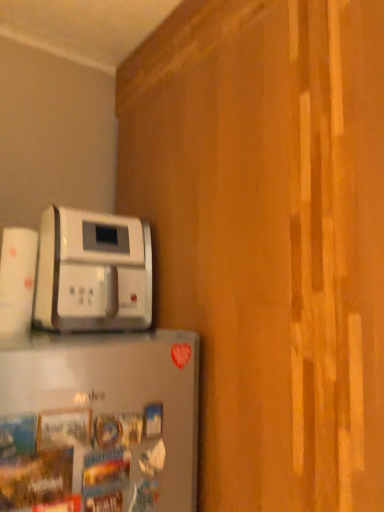
Question: Is point (125, 293) closer or farther from the camera than point (41, 456)?

Choices:
 (A) farther
 (B) closer

Answer: (A)

Question: Is white plastic coffee maker at upper left, the 2th home appliance positioned from the front, bigger or smaller than satin silver refrigerator at lower left, which appears as the 1th home appliance when ordered from the bottom?

Choices:
 (A) small
 (B) big

Answer: (B)

Question: Is white plastic coffee maker at upper left, which is the 1th home appliance from top to bottom, in front of or behind satin silver refrigerator at lower left, the second home appliance from the top, in the image?

Choices:
 (A) front
 (B) behind

Answer: (B)

Question: From a real-world perspective, is satin silver refrigerator at lower left, the second home appliance from the top, positioned above or below white plastic coffee maker at upper left, which is the 1th home appliance from top to bottom?

Choices:
 (A) below
 (B) above

Answer: (A)

Question: From the image's perspective, is satin silver refrigerator at lower left, which appears as the 1th home appliance when viewed from the front, above or below white plastic coffee maker at upper left, which ranks as the first home appliance in back-to-front order?

Choices:
 (A) below
 (B) above

Answer: (A)

Question: Is satin silver refrigerator at lower left, the second home appliance from the top, inside the boundaries of white plastic coffee maker at upper left, which is the 1th home appliance from top to bottom, or outside?

Choices:
 (A) inside
 (B) outside

Answer: (B)

Question: Looking at the image, does satin silver refrigerator at lower left, which appears as the 1th home appliance when ordered from the bottom, seem bigger or smaller compared to white plastic coffee maker at upper left, the 2th home appliance positioned from the front?

Choices:
 (A) small
 (B) big

Answer: (A)